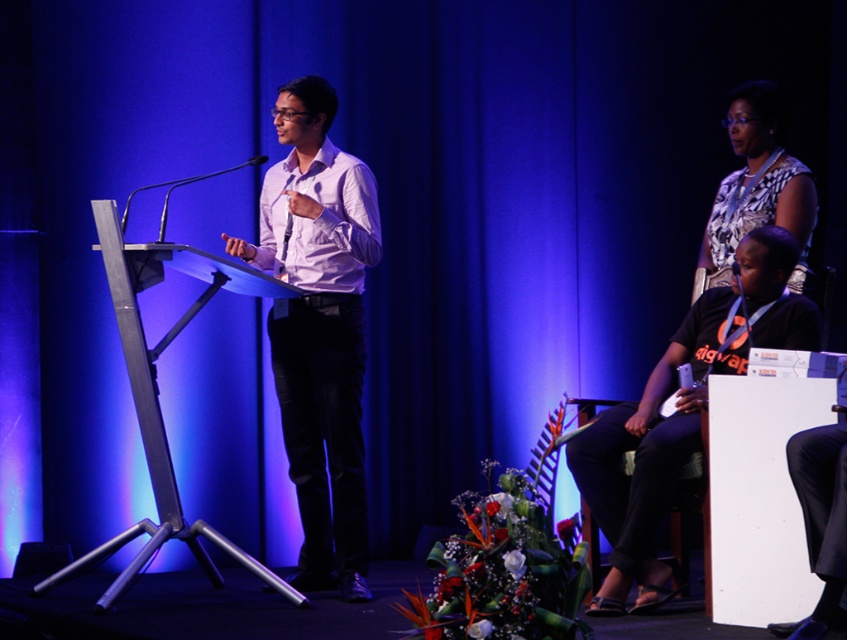
You are organizing a photo shoot and need to ensure that the white glossy shirt at center and the black matte shirt at center are positioned exactly 1 meter apart. Based on the scene described, will their current positioning meet this requirement?

The white glossy shirt at center and the black matte shirt at center are 1.02 meters apart, which is slightly more than 1 meter. Therefore, their current positioning meets the requirement as they are positioned just over the required distance.

Based on the photo, you are standing on the stage and want to hand a document to the black matte shirt at center. Where should you move to in order to reach them?

The black matte shirt at center is located at the coordinates 0.706 on the x axis and 0.770 on the y axis, so you should move to that position to reach them.